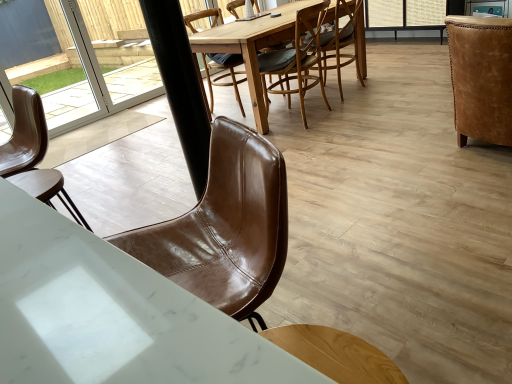
Question: In which direction should I rotate to look at brown leather chair at center, arranged as the third chair when viewed from the right?

Choices:
 (A) right
 (B) left

Answer: (A)

Question: Is black matte pole at center facing towards leather armchair at right, placed as the 5th chair when sorted from left to right?

Choices:
 (A) no
 (B) yes

Answer: (A)

Question: Considering the relative sizes of black matte pole at center and leather armchair at right, the 1th chair viewed from the right, in the image provided, is black matte pole at center shorter than leather armchair at right, the 1th chair viewed from the right,?

Choices:
 (A) no
 (B) yes

Answer: (A)

Question: Can you confirm if black matte pole at center is positioned to the left of leather armchair at right, the 1th chair viewed from the right?

Choices:
 (A) no
 (B) yes

Answer: (B)

Question: Considering the relative positions of black matte pole at center and leather armchair at right, placed as the 5th chair when sorted from left to right, in the image provided, is black matte pole at center behind leather armchair at right, placed as the 5th chair when sorted from left to right,?

Choices:
 (A) yes
 (B) no

Answer: (B)

Question: Is leather armchair at right, the 1th chair viewed from the right, inside black matte pole at center?

Choices:
 (A) no
 (B) yes

Answer: (A)

Question: Considering the relative sizes of black matte pole at center and leather armchair at right, the 1th chair viewed from the right, in the image provided, is black matte pole at center smaller than leather armchair at right, the 1th chair viewed from the right,?

Choices:
 (A) yes
 (B) no

Answer: (A)

Question: Considering the relative sizes of transparent glass door at upper left and white marble desk at lower left in the image provided, is transparent glass door at upper left taller than white marble desk at lower left?

Choices:
 (A) yes
 (B) no

Answer: (A)

Question: Can you confirm if transparent glass door at upper left is thinner than white marble desk at lower left?

Choices:
 (A) yes
 (B) no

Answer: (A)

Question: Does transparent glass door at upper left turn towards white marble desk at lower left?

Choices:
 (A) yes
 (B) no

Answer: (A)

Question: Is transparent glass door at upper left not within white marble desk at lower left?

Choices:
 (A) no
 (B) yes

Answer: (B)

Question: Is transparent glass door at upper left in contact with white marble desk at lower left?

Choices:
 (A) no
 (B) yes

Answer: (A)

Question: From the image's perspective, is transparent glass door at upper left below white marble desk at lower left?

Choices:
 (A) no
 (B) yes

Answer: (A)

Question: From a real-world perspective, is wooden round table at center physically below leather armchair at right, the 1th chair viewed from the right?

Choices:
 (A) no
 (B) yes

Answer: (B)